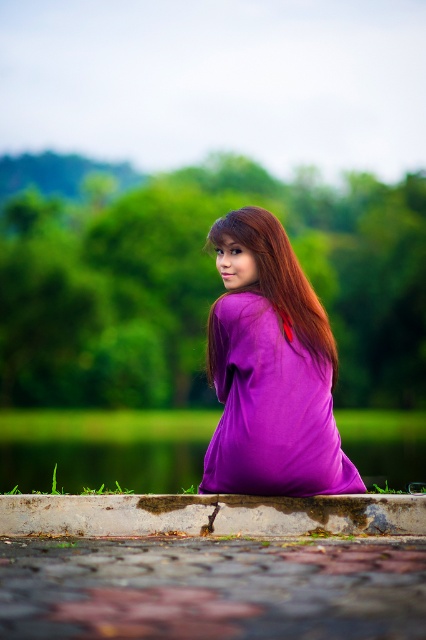
You are a photographer trying to capture the purple matte dress at center and the concrete curb at lower center in the same frame. Based on their positions, which object is closer to the camera?

The purple matte dress at center is closer to the camera because the concrete curb at lower center is behind it.

You are a photographer trying to capture the purple matte dress at center and the concrete curb at lower center in a single frame. Based on their sizes, which object should you focus on first to ensure both are clearly visible in the photo?

The purple matte dress at center is smaller than the concrete curb at lower center, so you should focus on the concrete curb at lower center first since it is larger and will remain in focus while adjusting for the smaller dress.